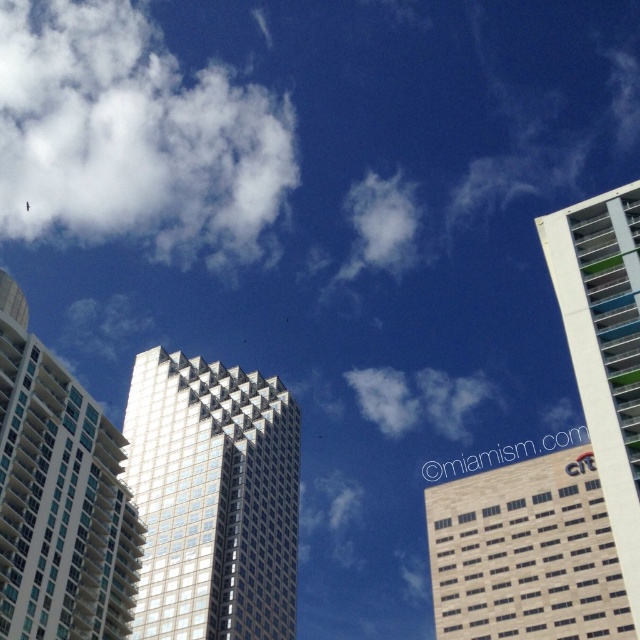
You are standing in the middle of the city square and looking up at the metallic glass skyscraper at center and the beige brick building at center. Which building appears closer to you?

The metallic glass skyscraper at center appears closer to you because it is further to the viewer than the beige brick building at center.

Based on the photo, you are an architect evaluating the urban skyline. You need to determine which building is bigger between the metallic glass skyscraper at center and the white glass building at upper right. Which one is larger?

The metallic glass skyscraper at center has a larger size compared to the white glass building at upper right, so the metallic glass skyscraper at center is larger.